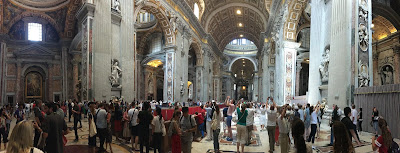
Image resolution: width=400 pixels, height=153 pixels. What are the coordinates of `ceiling` in the screenshot? It's located at (224, 19).